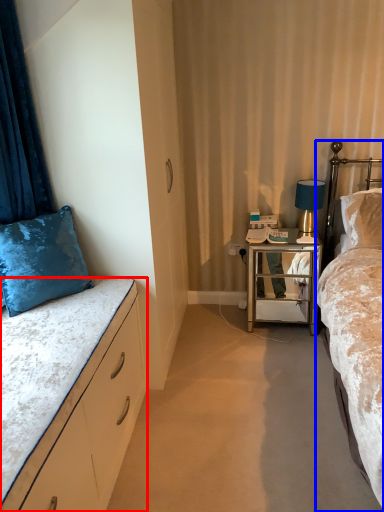
Question: Which object is closer to the camera taking this photo, bed (highlighted by a red box) or bed (highlighted by a blue box)?

Choices:
 (A) bed
 (B) bed

Answer: (B)